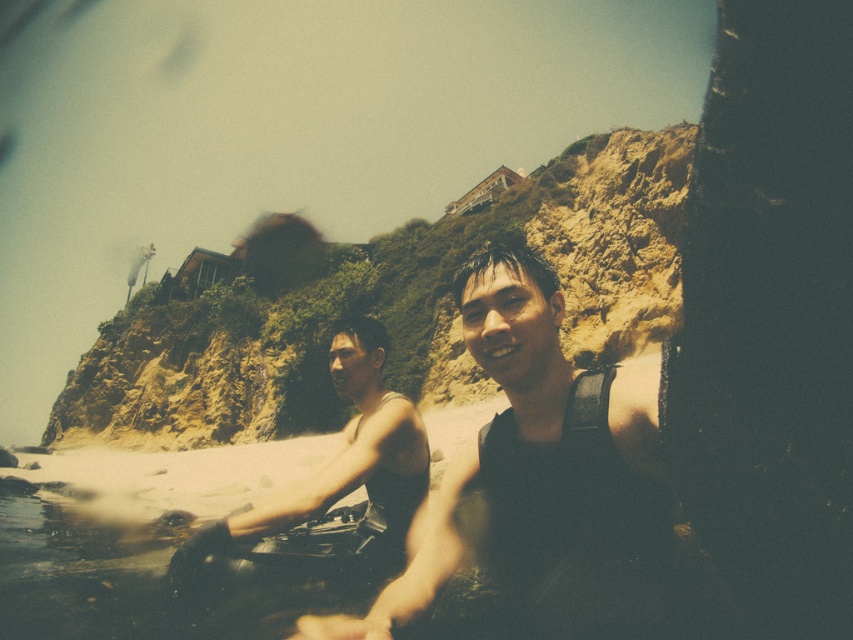
You are a photographer trying to capture the two people in the scene. You want to ensure that the dark gray wetsuit at center and the matte black wetsuit at center are both clearly visible in your shot. Based on their positions, which one should you focus on first to ensure both are in frame?

The dark gray wetsuit at center is positioned on the right side of the matte black wetsuit at center. To ensure both are in frame, you should focus on the matte black wetsuit at center first, as it is closer to the center of the image, allowing the dark gray wetsuit at center to be captured on its right side.